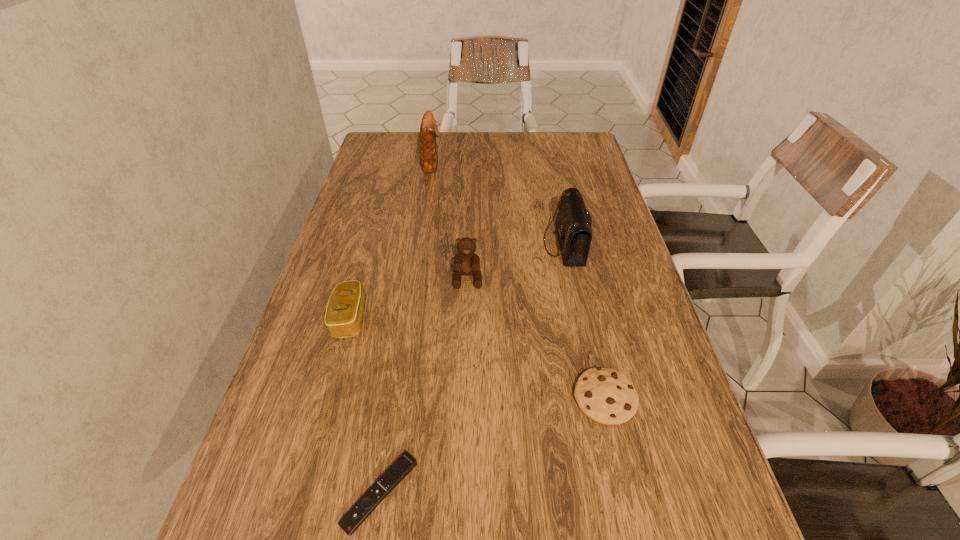
Find the location of a particular element. object present at the far edge is located at coordinates (429, 131).

Identify the location of object that is positioned at the left edge. The height and width of the screenshot is (540, 960). (344, 314).

You are a GUI agent. You are given a task and a screenshot of the screen. Output one action in this format:
    pyautogui.click(x=<x>, y=<y>)
    Task: Click on the clutch bag positioned at the right edge
    
    Given the screenshot: What is the action you would take?
    pyautogui.click(x=573, y=224)

Find the location of a particular element. Image resolution: width=960 pixels, height=540 pixels. cookie at the right edge is located at coordinates (605, 395).

In the image, there is a desktop. Where is `vacant region at the far edge`? This screenshot has height=540, width=960. vacant region at the far edge is located at coordinates (528, 156).

Find the location of `vacant space at the left edge of the desktop`. vacant space at the left edge of the desktop is located at coordinates (379, 226).

Locate an element on the screen. free location at the right edge is located at coordinates (660, 432).

In the image, there is a desktop. Where is `free space at the far left corner`? The width and height of the screenshot is (960, 540). free space at the far left corner is located at coordinates (386, 151).

The width and height of the screenshot is (960, 540). In order to click on free space at the far right corner of the desktop in this screenshot , I will do `click(586, 147)`.

Find the location of a particular element. This screenshot has height=540, width=960. vacant area that lies between the rightmost clutch bag and the fourth object from left to right is located at coordinates (516, 261).